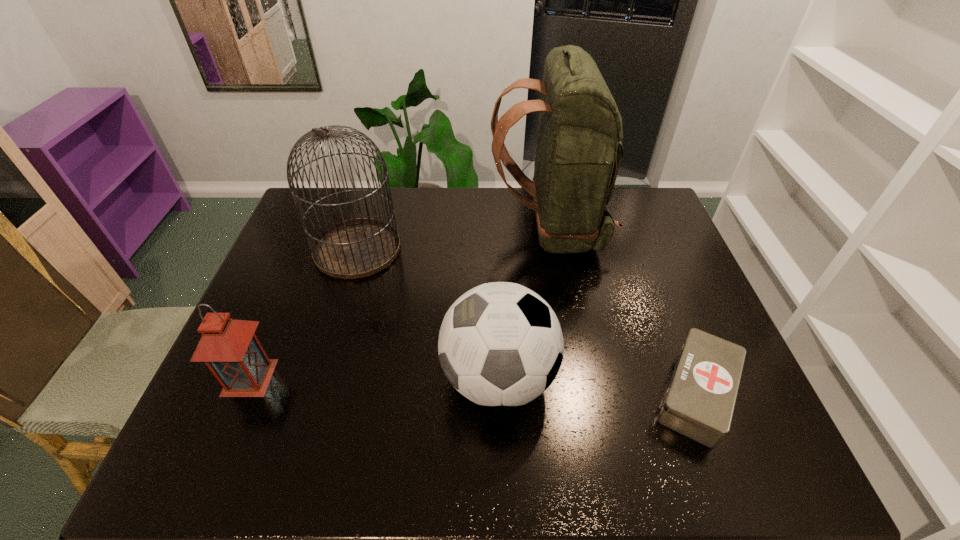
This screenshot has height=540, width=960. In order to click on backpack in this screenshot , I will do `click(578, 154)`.

Find the location of a particular element. This screenshot has height=540, width=960. the second tallest object is located at coordinates (356, 248).

Identify the location of soccer ball. The width and height of the screenshot is (960, 540). (500, 345).

At what (x,y) coordinates should I click in order to perform the action: click on lantern. Please return your answer as a coordinate pair (x, y). Image resolution: width=960 pixels, height=540 pixels. Looking at the image, I should click on (231, 350).

Find the location of a particular element. the first-aid kit is located at coordinates (699, 403).

I want to click on vacant space situated 0.270m on the back of the tallest object, so click(x=408, y=230).

Where is `vacant space located on the back of the tallest object`? This screenshot has height=540, width=960. vacant space located on the back of the tallest object is located at coordinates (435, 230).

Locate an element on the screen. free spot located 0.390m on the back of the tallest object is located at coordinates (372, 230).

This screenshot has width=960, height=540. Identify the location of vacant space situated 0.380m on the front of the second tallest object. (314, 395).

Locate an element on the screen. The height and width of the screenshot is (540, 960). vacant space located on the main logo of the soccer ball is located at coordinates (300, 378).